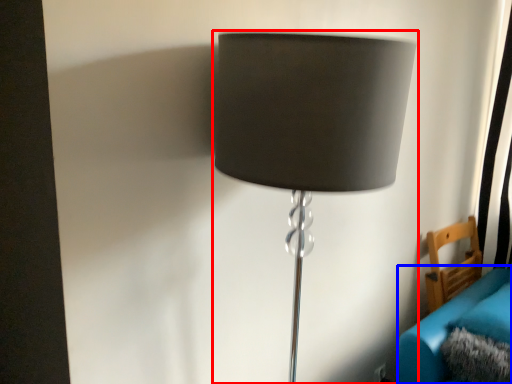
Question: Which object appears farthest to the camera in this image, lamp (highlighted by a red box) or couch (highlighted by a blue box)?

Choices:
 (A) lamp
 (B) couch

Answer: (B)